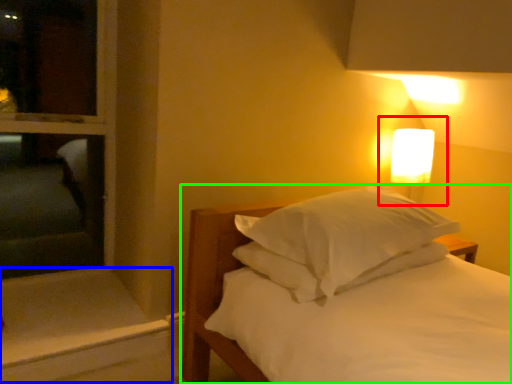
Question: Considering the real-world distances, which object is farthest from bedside lamp (highlighted by a red box)? window sill (highlighted by a blue box) or bed (highlighted by a green box)?

Choices:
 (A) window sill
 (B) bed

Answer: (A)